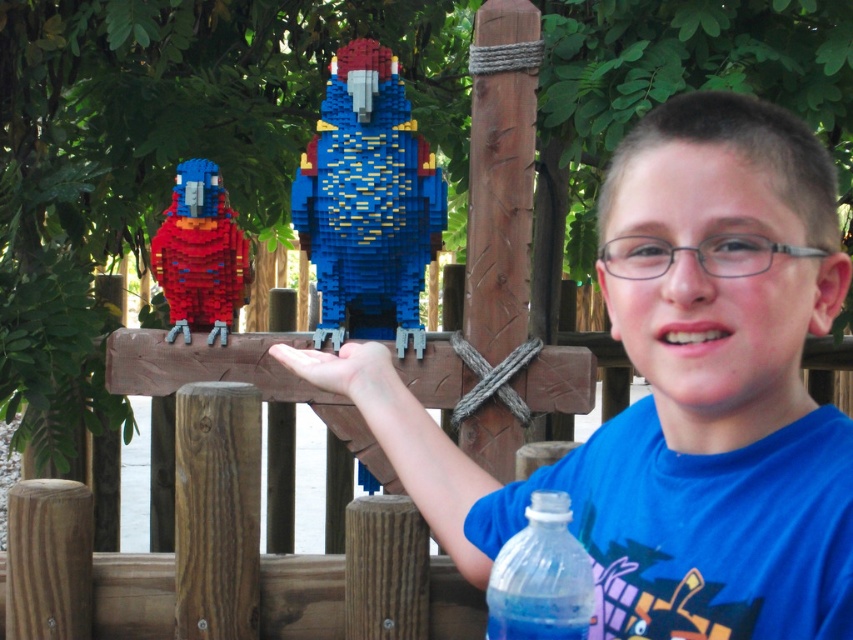
Is point (518, 608) farther from viewer compared to point (380, 412)?

No.

Is transparent plastic bottle at lower right behind matte flesh-colored hand at center?

That is False.

Between point (531, 513) and point (352, 392), which one is positioned in front?

Point (531, 513) is in front.

Locate an element on the screen. The height and width of the screenshot is (640, 853). transparent plastic bottle at lower right is located at coordinates (541, 577).

The image size is (853, 640). What do you see at coordinates (368, 202) in the screenshot?
I see `blue lego parrot at center` at bounding box center [368, 202].

Which is more to the left, blue lego parrot at center or transparent plastic bottle at lower right?

From the viewer's perspective, blue lego parrot at center appears more on the left side.

What do you see at coordinates (368, 202) in the screenshot?
I see `blue lego parrot at center` at bounding box center [368, 202].

The image size is (853, 640). I want to click on blue lego parrot at center, so click(368, 202).

Which is above, blue matte lego figure at upper center or matte flesh-colored hand at center?

matte flesh-colored hand at center

Which is behind, point (607, 461) or point (381, 394)?

The point (381, 394) is behind.

I want to click on blue matte lego figure at upper center, so click(x=691, y=394).

This screenshot has width=853, height=640. Identify the location of blue matte lego figure at upper center. (691, 394).